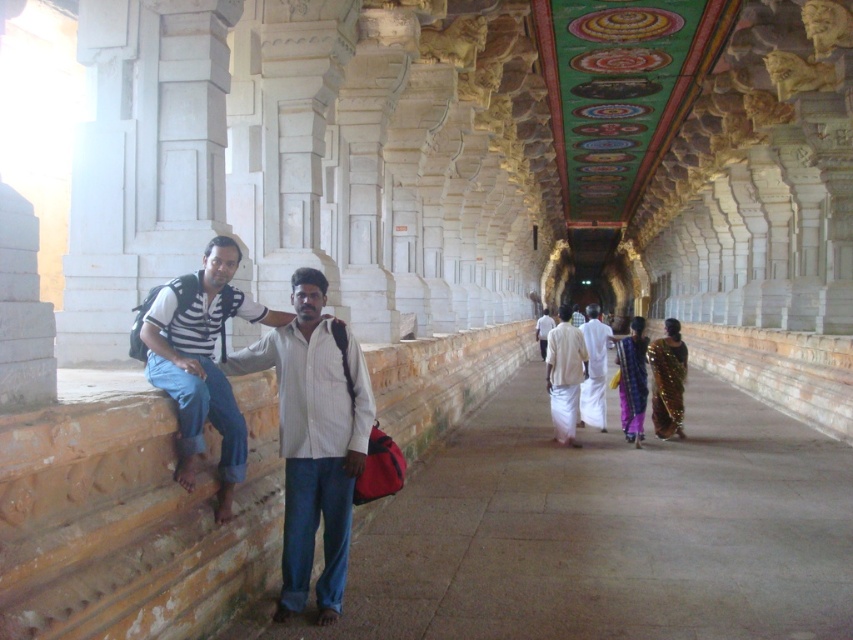
Question: Does white cotton shirt at center appear over striped cotton shirt at left?

Choices:
 (A) no
 (B) yes

Answer: (A)

Question: Considering the relative positions of white cotton shirt at center and silky gold saree at center in the image provided, where is white cotton shirt at center located with respect to silky gold saree at center?

Choices:
 (A) left
 (B) right

Answer: (A)

Question: Is white cotton shirt at center further to camera compared to silky gold saree at center?

Choices:
 (A) no
 (B) yes

Answer: (A)

Question: Based on their relative distances, which object is farther from the light brown fabric shirt at center?

Choices:
 (A) light beige cotton dhoti at center
 (B) striped cotton shirt at left

Answer: (B)

Question: Which of the following is the farthest from the observer?

Choices:
 (A) silky gold saree at center
 (B) white cotton shirt at center
 (C) light beige cotton dhoti at center
 (D) light brown fabric shirt at center

Answer: (D)

Question: Which object appears closest to the camera in this image?

Choices:
 (A) white cotton shirt at center
 (B) light beige cotton dhoti at center
 (C) silky gold saree at center

Answer: (A)